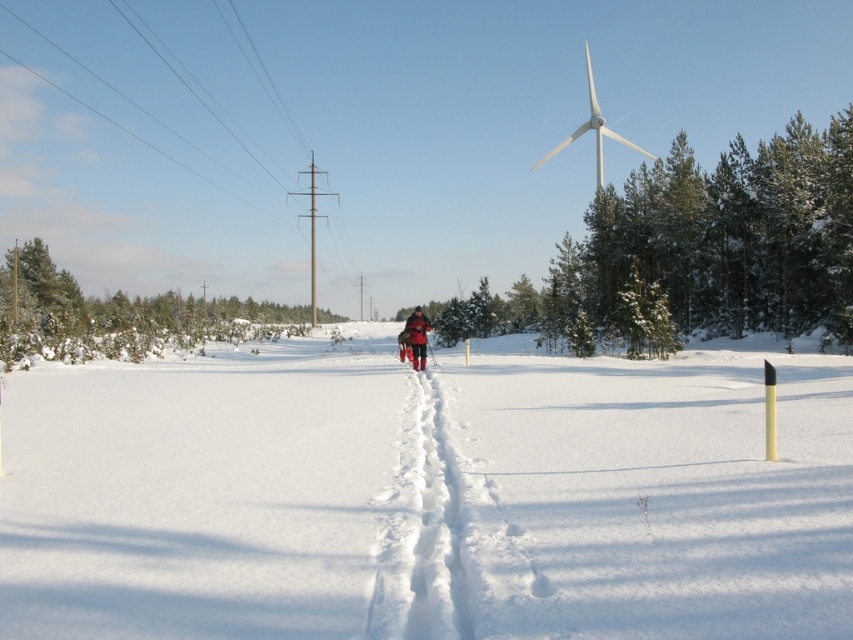
You are planning to build a small cabin in the winter landscape. The cabin requires a space that is wider than the gray metallic windmill at center. Can the white powdery snow at center provide enough width for this requirement?

The white powdery snow at center is wider than the gray metallic windmill at center, so yes, the white powdery snow at center can provide enough width for the cabin that requires a space wider than the gray metallic windmill at center.

You are a photographer planning to capture the winter scene. You want to ensure the red fabric jacket at center is visible against the white powdery snow at center. Based on the scene description, will the contrast between the two objects be sufficient for a clear photograph?

The white powdery snow at center has a larger size compared to red fabric jacket at center. The contrast between the red fabric jacket at center and the white powdery snow at center should be sufficient because the red color provides strong visual contrast against the white snow, making the jacket easily distinguishable even if the snow is larger in size.